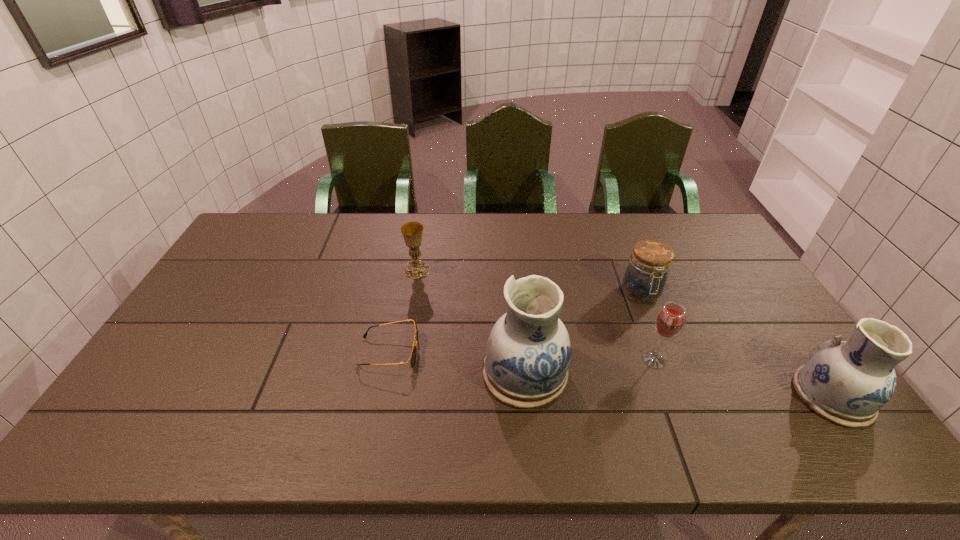
Identify the location of the taller pottery. Image resolution: width=960 pixels, height=540 pixels. (528, 352).

Image resolution: width=960 pixels, height=540 pixels. What are the coordinates of `the tallest object` in the screenshot? It's located at (528, 352).

I want to click on the rightmost object, so click(x=847, y=382).

Locate an element on the screen. This screenshot has width=960, height=540. the shorter pottery is located at coordinates (847, 382).

Identify the location of jar. (645, 277).

Find the location of a particular element. the farthest object is located at coordinates (412, 232).

Locate an element on the screen. wineglass is located at coordinates (669, 322).

This screenshot has width=960, height=540. I want to click on the shortest object, so click(412, 357).

This screenshot has height=540, width=960. What are the coordinates of `free space located 0.190m on the right of the taller pottery` in the screenshot? It's located at (641, 372).

Find the location of a particular element. free space located on the back of the rightmost object is located at coordinates (750, 278).